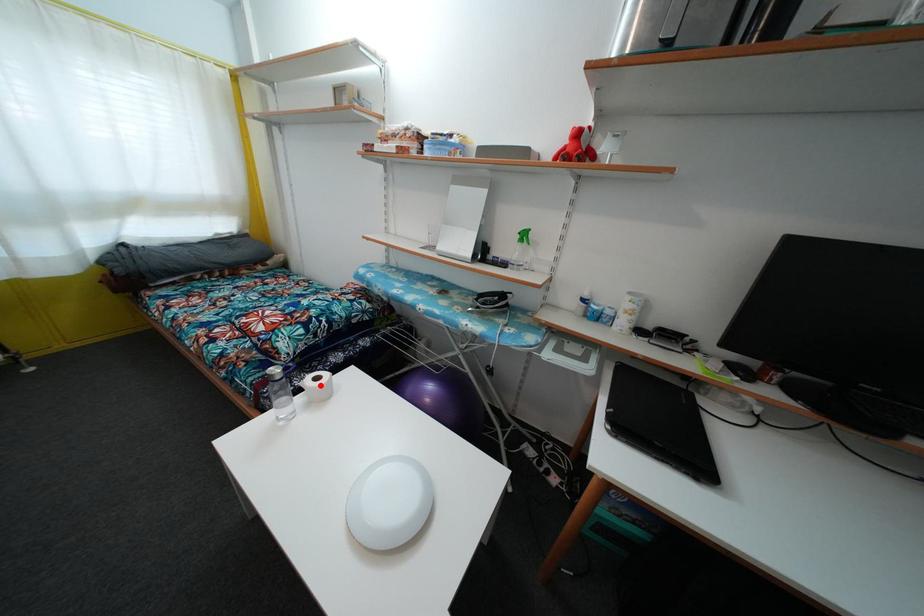
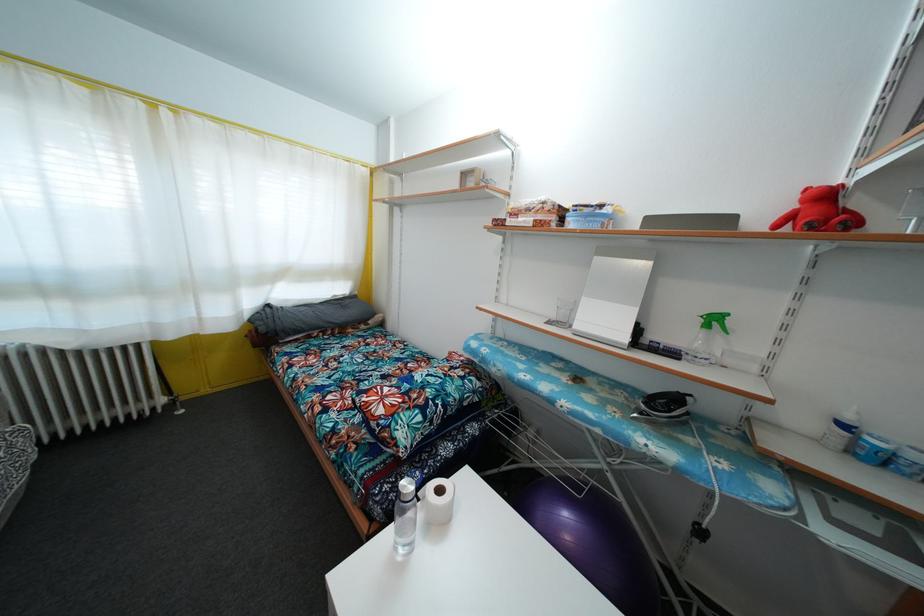
Where in the second image is the point corresponding to the highlighted location from the first image?

(444, 498)